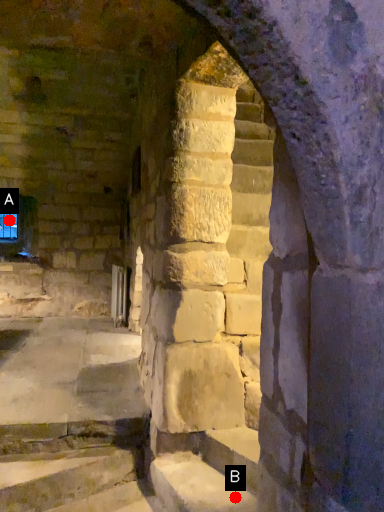
Question: Two points are circled on the image, labeled by A and B beside each circle. Which point is closer to the camera taking this photo?

Choices:
 (A) A is closer
 (B) B is closer

Answer: (B)